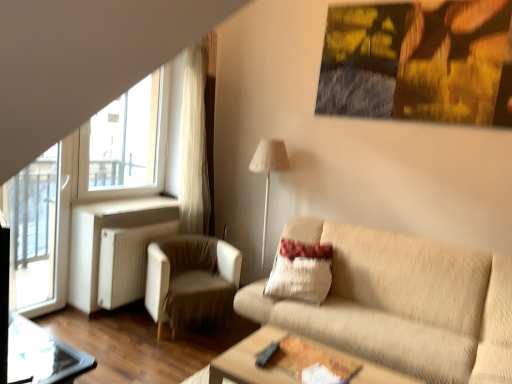
Image resolution: width=512 pixels, height=384 pixels. In order to click on vacant space situated above wooden table at lower center (from a real-world perspective) in this screenshot , I will do `click(303, 364)`.